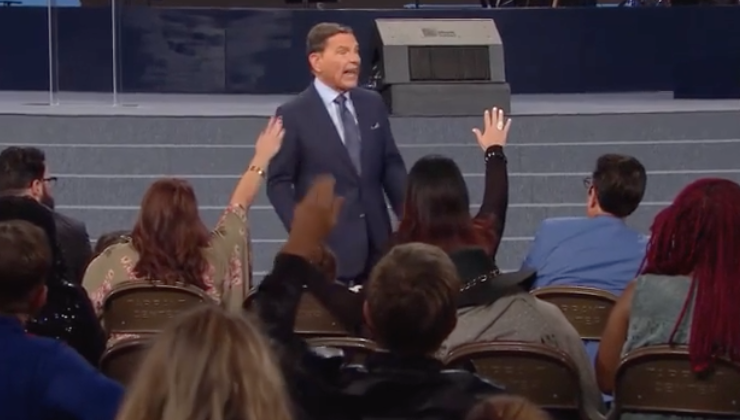
You are a GUI agent. You are given a task and a screenshot of the screen. Output one action in this format:
    pyautogui.click(x=<x>, y=<y>)
    Task: Click on the stage
    The width and height of the screenshot is (740, 420).
    Given the screenshot: What is the action you would take?
    pyautogui.click(x=562, y=107), pyautogui.click(x=175, y=105)